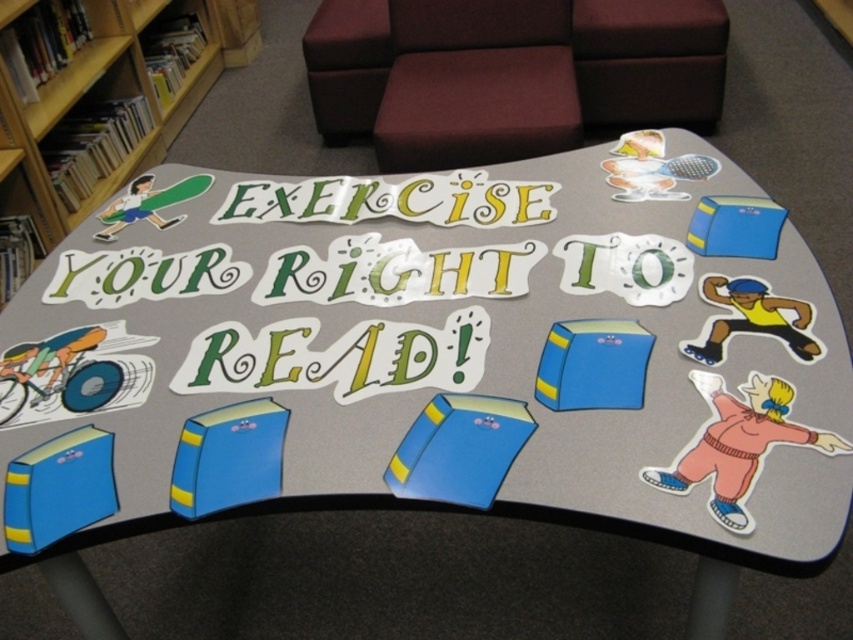
Which of these two, smooth leather stool at upper center or maroon fabric stool at upper center, stands taller?

Standing taller between the two is maroon fabric stool at upper center.

Can you confirm if smooth leather stool at upper center is positioned below maroon fabric stool at upper center?

Yes.

Locate an element on the screen. smooth leather stool at upper center is located at coordinates (648, 60).

From the picture: Can you confirm if velvet-like maroon stool at center is bigger than smooth leather stool at upper center?

Indeed, velvet-like maroon stool at center has a larger size compared to smooth leather stool at upper center.

Which is below, velvet-like maroon stool at center or smooth leather stool at upper center?

velvet-like maroon stool at center

At what (x,y) coordinates should I click in order to perform the action: click on velvet-like maroon stool at center. Please return your answer as a coordinate pair (x, y). This screenshot has width=853, height=640. Looking at the image, I should click on (476, 108).

Where is `velvet-like maroon stool at center`? Image resolution: width=853 pixels, height=640 pixels. velvet-like maroon stool at center is located at coordinates (476, 108).

Which of these two, velvet-like maroon stool at center or maroon fabric stool at upper center, stands taller?

With more height is maroon fabric stool at upper center.

Is velvet-like maroon stool at center shorter than maroon fabric stool at upper center?

Yes.

Is point (410, 56) positioned before point (338, 52)?

Yes, it is in front of point (338, 52).

Locate an element on the screen. The image size is (853, 640). velvet-like maroon stool at center is located at coordinates (476, 108).